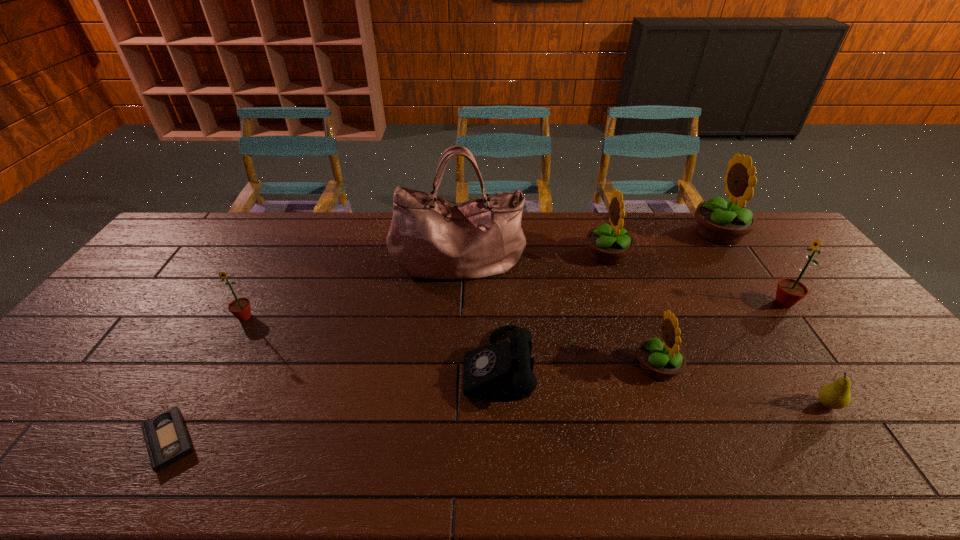
Identify the location of vacant space located on the back of the shortest object. (238, 317).

This screenshot has width=960, height=540. In order to click on handbag at the far edge in this screenshot , I will do `click(430, 237)`.

Image resolution: width=960 pixels, height=540 pixels. What are the coordinates of `object located in the near edge section of the desktop` in the screenshot? It's located at 166,437.

This screenshot has width=960, height=540. What are the coordinates of `object at the far right corner` in the screenshot? It's located at (720, 221).

Where is `vacant space at the far edge of the desktop`? Image resolution: width=960 pixels, height=540 pixels. vacant space at the far edge of the desktop is located at coordinates (649, 238).

Find the location of a particular element. This screenshot has width=960, height=540. free space at the near edge of the desktop is located at coordinates (234, 476).

This screenshot has width=960, height=540. Find the location of `free space at the left edge of the desktop`. free space at the left edge of the desktop is located at coordinates (117, 327).

In the image, there is a desktop. Find the location of `vacant space at the right edge`. vacant space at the right edge is located at coordinates (874, 349).

The image size is (960, 540). What are the coordinates of `vacant point at the far left corner` in the screenshot? It's located at (183, 237).

What are the coordinates of `unoccupied position between the pear and the videotape` in the screenshot? It's located at (498, 422).